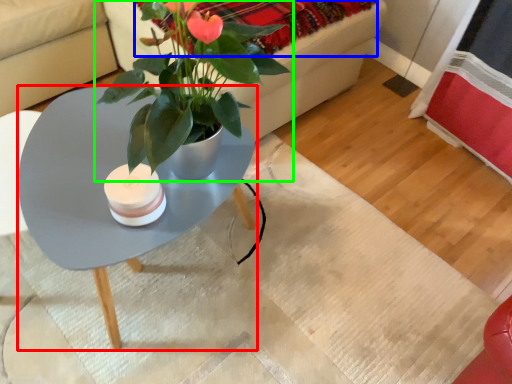
Question: Which object is the farthest from coffee table (highlighted by a red box)? Choose among these: blanket (highlighted by a blue box) or houseplant (highlighted by a green box).

Choices:
 (A) blanket
 (B) houseplant

Answer: (A)